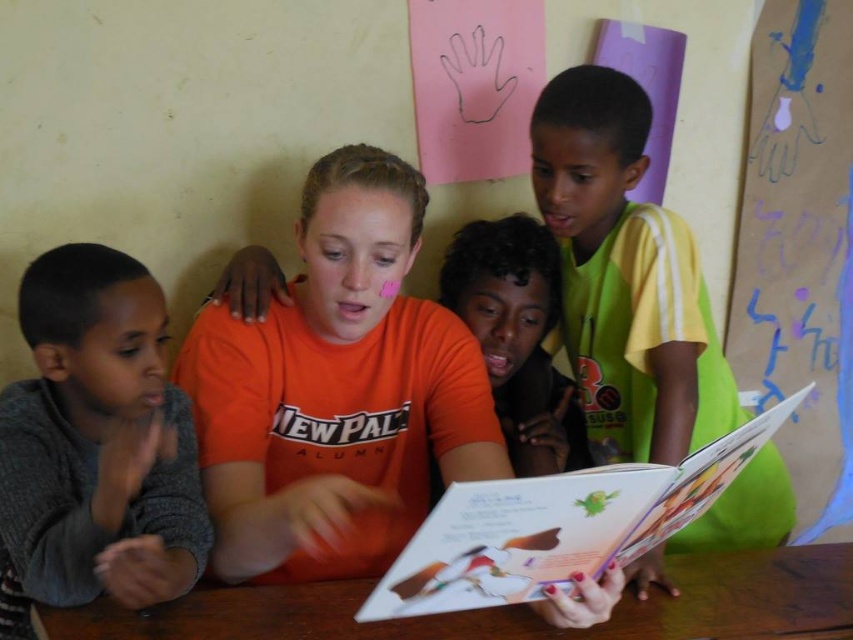
Question: Does orange matte shirt at center appear under paperboard book at center?

Choices:
 (A) no
 (B) yes

Answer: (A)

Question: Among these objects, which one is nearest to the camera?

Choices:
 (A) yellow jersey at right
 (B) wooden table at lower center

Answer: (B)

Question: Which object appears farthest from the camera in this image?

Choices:
 (A) orange matte shirt at center
 (B) wooden table at lower center
 (C) gray knitted sweater at left

Answer: (B)

Question: Which point is closer to the camera?

Choices:
 (A) orange matte shirt at center
 (B) gray knitted sweater at left

Answer: (B)

Question: Is orange matte shirt at center above yellow jersey at right?

Choices:
 (A) no
 (B) yes

Answer: (A)

Question: Is orange matte shirt at center to the right of orange t-shirt at center from the viewer's perspective?

Choices:
 (A) no
 (B) yes

Answer: (A)